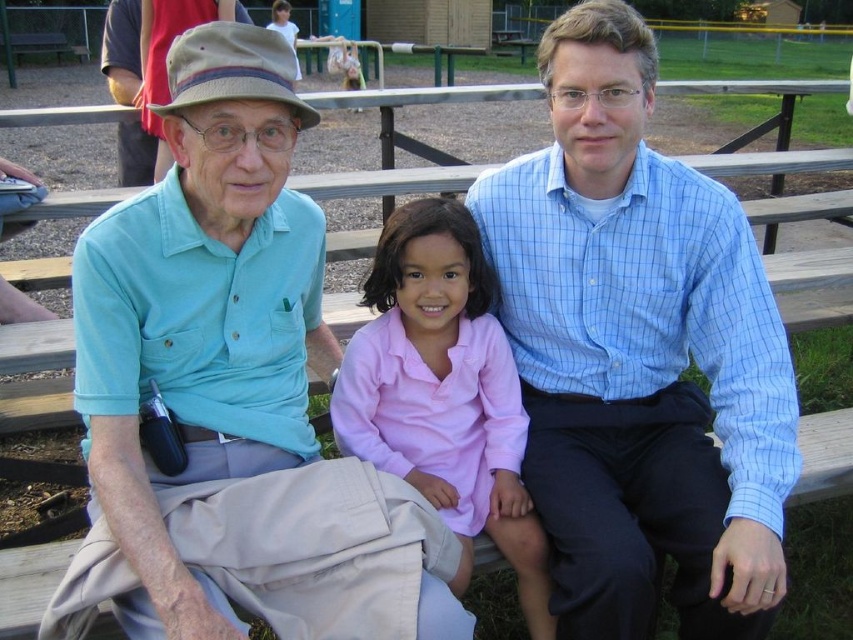
Question: Considering the relative positions of light blue shirt at left and blue checkered shirt at center in the image provided, where is light blue shirt at left located with respect to blue checkered shirt at center?

Choices:
 (A) above
 (B) below

Answer: (B)

Question: Which of these objects is positioned closest to the blue checkered shirt at center?

Choices:
 (A) light blue shirt at left
 (B) pink cotton shirt at center

Answer: (B)

Question: Is light blue shirt at left to the right of pink cotton shirt at center from the viewer's perspective?

Choices:
 (A) no
 (B) yes

Answer: (A)

Question: Among these points, which one is nearest to the camera?

Choices:
 (A) (270, 394)
 (B) (474, 428)

Answer: (A)

Question: Is blue checkered shirt at center to the left of pink cotton shirt at center from the viewer's perspective?

Choices:
 (A) yes
 (B) no

Answer: (B)

Question: Among these objects, which one is nearest to the camera?

Choices:
 (A) light blue shirt at left
 (B) blue checkered shirt at center

Answer: (A)